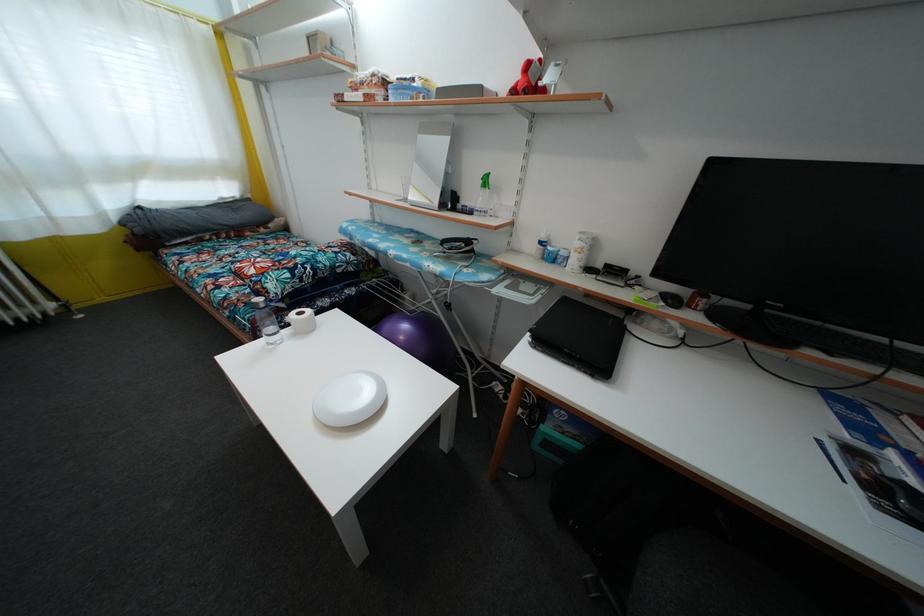
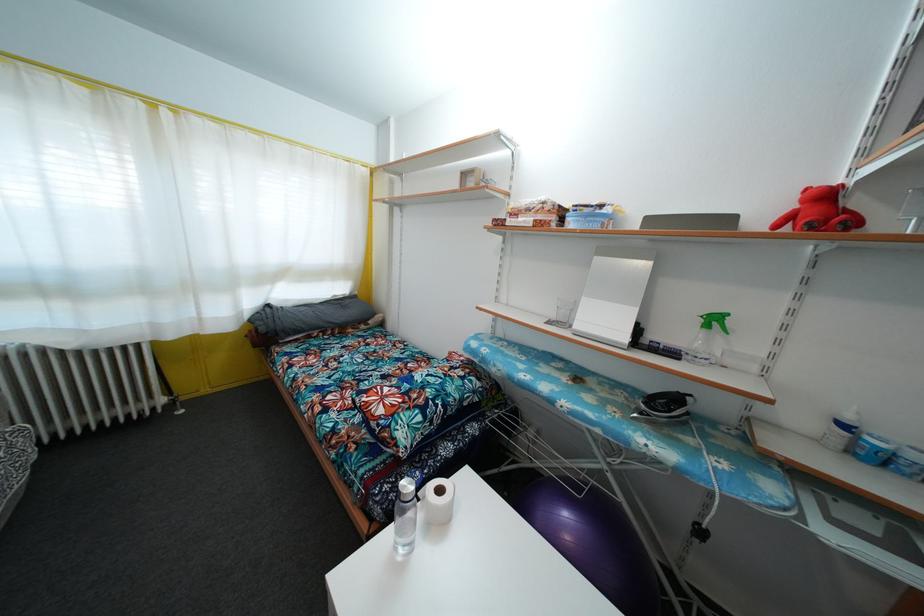
The point at (367, 90) is marked in the first image. Where is the corresponding point in the second image?

(531, 216)